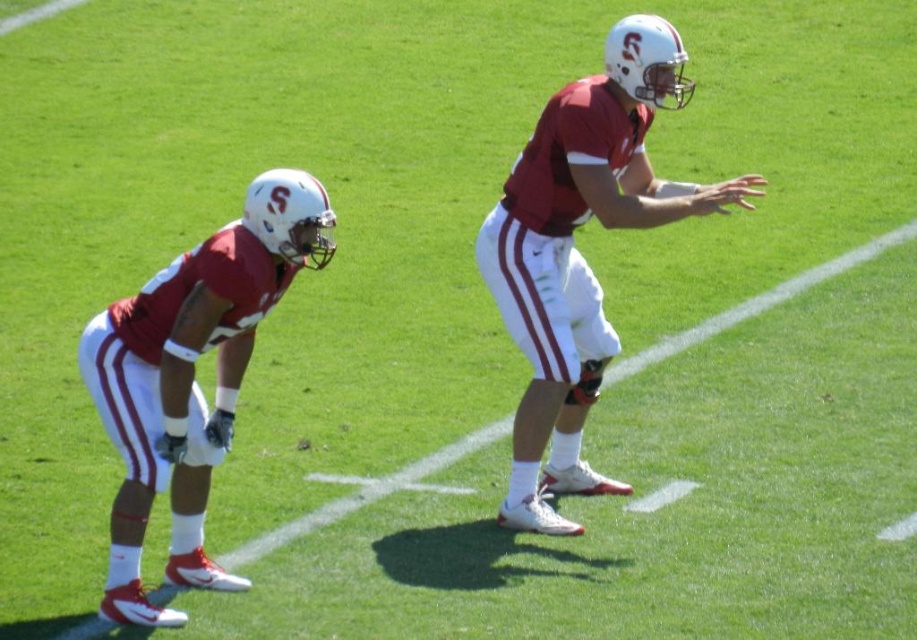
You are a coach observing two players in the field. You notice the matte red uniform at center and the matte red uniform at left. Which player should you address if you need to speak to the one wearing the larger uniform?

You should address the matte red uniform at center because it is larger in size than the matte red uniform at left.

You are a coach observing two players in the field. You see the matte red uniform at center and the matte red uniform at left. Which player is positioned closer to the starting line?

The matte red uniform at left is behind the matte red uniform at center, so the matte red uniform at center is closer to the starting line.